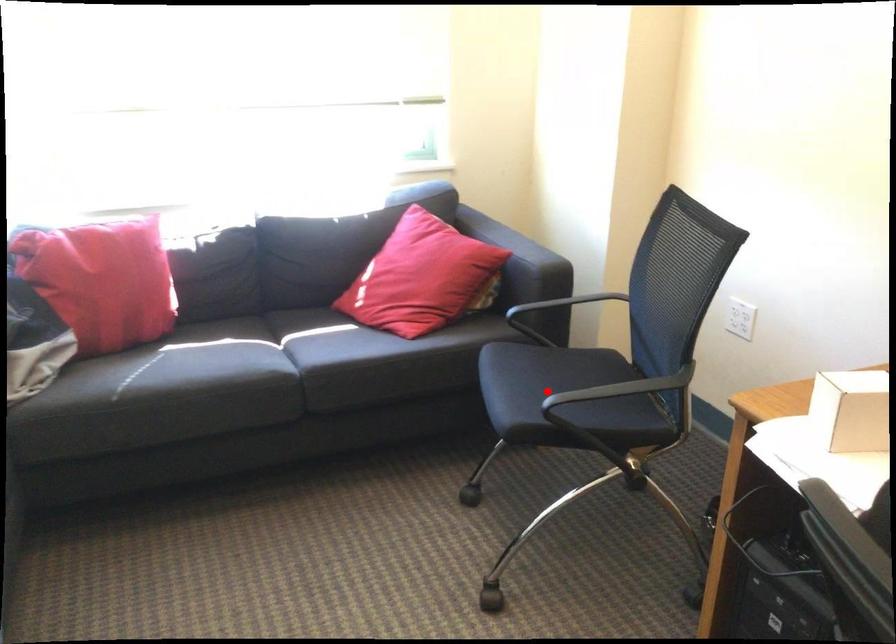
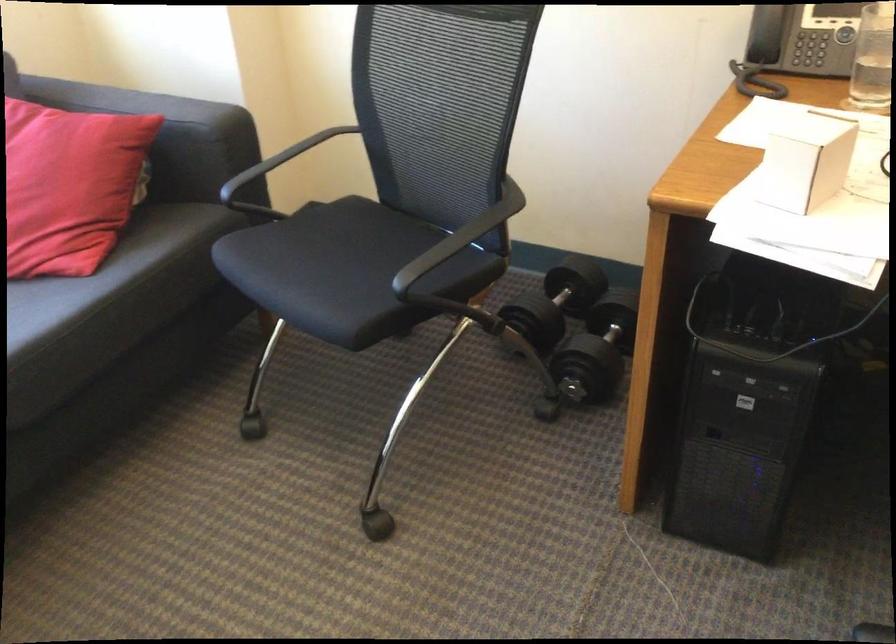
The point at the highlighted location is marked in the first image. Where is the corresponding point in the second image?

(343, 270)